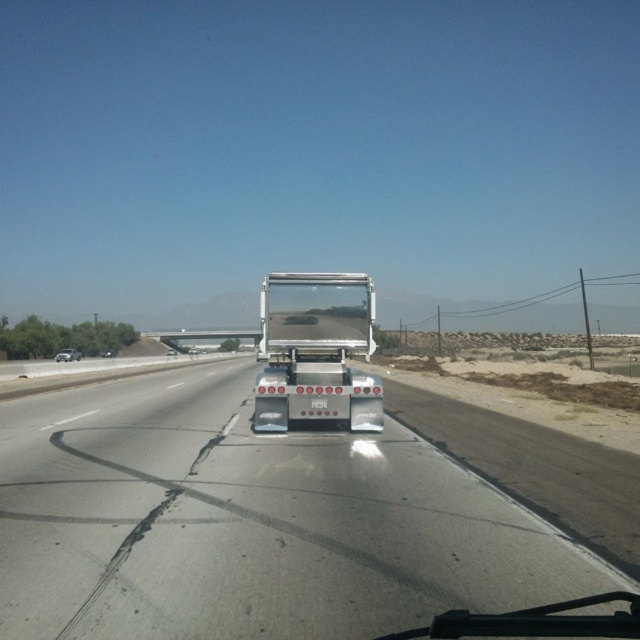
Can you confirm if metallic silver trailer truck at center is taller than transparent glass windshield at center?

No.

Who is more forward, (x=269, y=323) or (x=365, y=330)?

Point (x=269, y=323) is in front.

Describe the element at coordinates (316, 352) in the screenshot. Image resolution: width=640 pixels, height=640 pixels. I see `metallic silver trailer truck at center` at that location.

Where is `metallic silver trailer truck at center`? Image resolution: width=640 pixels, height=640 pixels. metallic silver trailer truck at center is located at coordinates (316, 352).

Identify the location of metallic silver truck at center. (248, 522).

Between metallic silver truck at center and silver metallic sedan at center, which one has more height?

silver metallic sedan at center

Where is `metallic silver truck at center`? metallic silver truck at center is located at coordinates (248, 522).

Between point (305, 291) and point (113, 353), which one is positioned in front?

Point (305, 291)

Looking at this image, does transparent glass windshield at center have a greater width compared to silver metallic sedan at center?

No.

Find the location of a particular element. Image resolution: width=640 pixels, height=640 pixels. transparent glass windshield at center is located at coordinates pos(317,310).